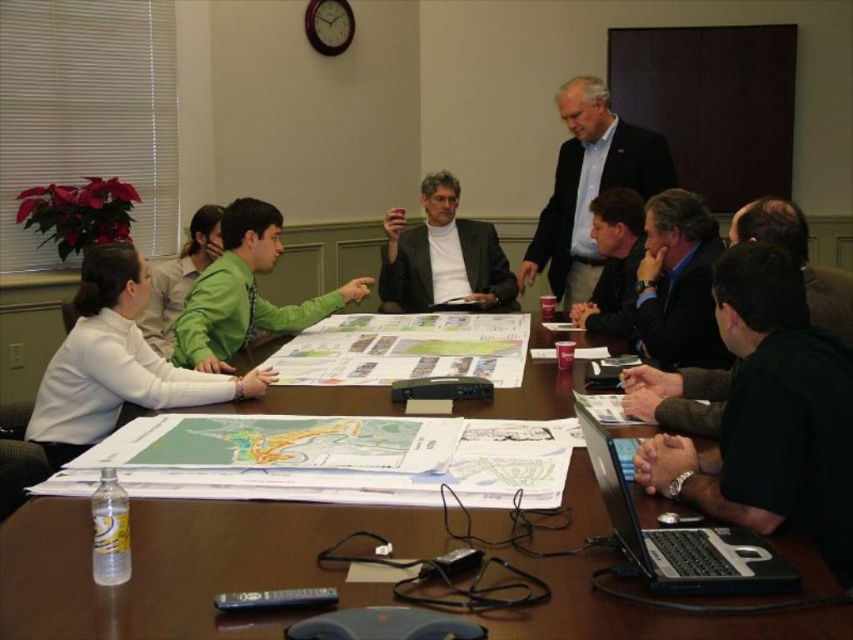
You are organizing a presentation and need to place a laptop on the table. The black plastic laptop at lower right is currently next to the black leather jacket at lower right. Considering their sizes, which item should you move to make space for the laptop?

You should move the black leather jacket at lower right because it is wider than the black plastic laptop at lower right, so moving it would free up more space.

You are sitting at the conference table and want to reach both the point at coordinates (239, 440) and the point at coordinates (740, 483). Which point will you reach first if you extend your arm straight out?

You will reach the point at coordinates (239, 440) first because it is closer to you than the point at coordinates (740, 483), which is further away.

You are sitting at the conference table and want to reach both the point at coordinates (645, 164) and the point at (642, 228). Which point should you reach for first if you want to touch them in the order from closest to farthest?

You should reach for point (642, 228) first because it is closer to you than point (645, 164), which is behind it.